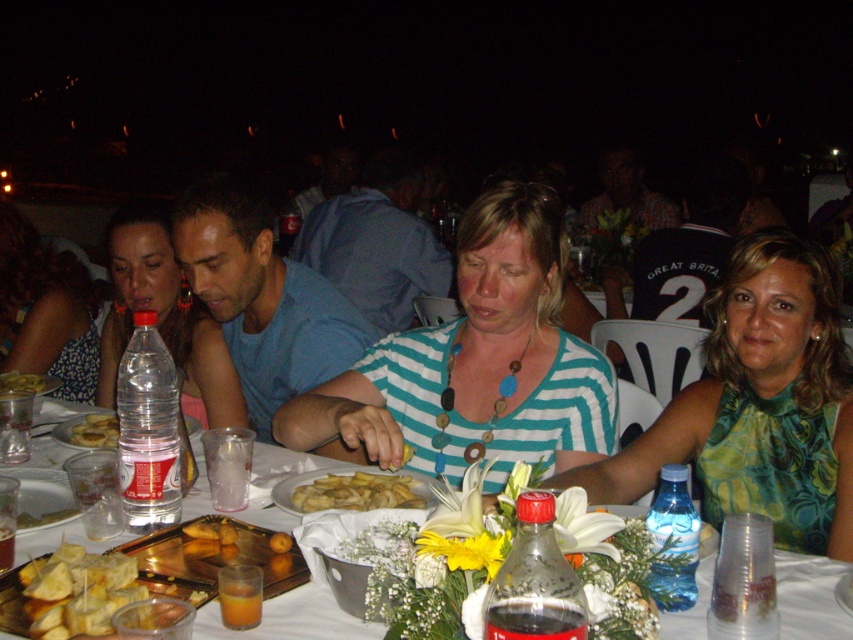
You are at a nighttime outdoor gathering and want to move from your current position to the entrance located at point (103, 422). There is an obstacle at point (36, 266). Can you safely walk around the obstacle to reach the entrance?

Point (36, 266) is behind point (103, 422), so the obstacle is behind the entrance. Therefore, you can safely walk towards the entrance without needing to go around the obstacle.

You are a photographer at the event and want to take a picture of the yellow fried chips at center without the green printed dress at center blocking it. What should you do?

Move the camera position to the side so that the green printed dress at center is no longer in front of the yellow fried chips at center, allowing the chips to be visible.

You are at a night party and want to pour water from one container to another. The dark glass bottle at table center and the translucent glass cup at table center are both on the table. Which container should you use as the source to pour into the other without spilling?

The dark glass bottle at table center is bigger than the translucent glass cup at table center, so you should pour from the dark glass bottle at table center into the translucent glass cup at table center to avoid spilling.